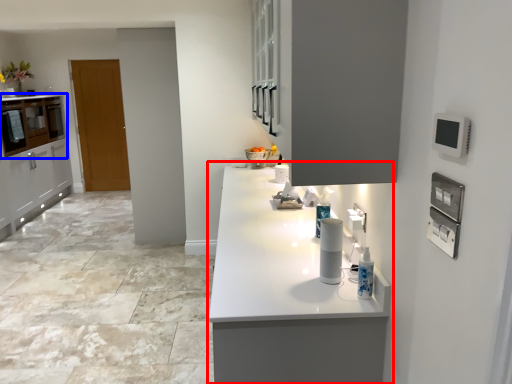
Question: Which of the following is the closest to the observer, countertop (highlighted by a red box) or cabinetry (highlighted by a blue box)?

Choices:
 (A) countertop
 (B) cabinetry

Answer: (A)